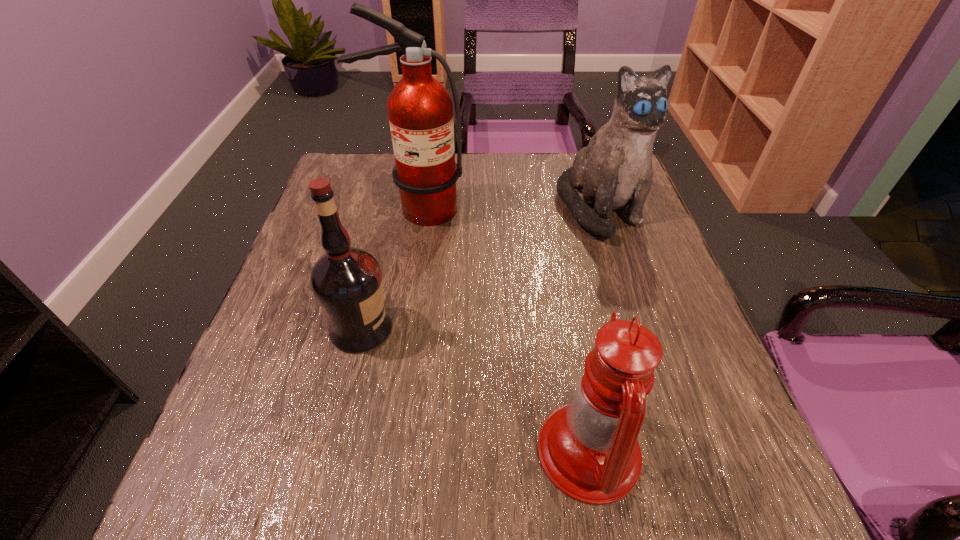
Where is `object at the near edge`? This screenshot has width=960, height=540. object at the near edge is located at coordinates (588, 449).

Identify the location of fire extinguisher present at the left edge. (420, 109).

You are a GUI agent. You are given a task and a screenshot of the screen. Output one action in this format:
    pyautogui.click(x=<x>, y=<y>)
    Task: Click on the liquor at the left edge
    This screenshot has width=960, height=540.
    Given the screenshot: What is the action you would take?
    pyautogui.click(x=347, y=283)

Where is `object that is at the right edge`? Image resolution: width=960 pixels, height=540 pixels. object that is at the right edge is located at coordinates (615, 170).

You are a GUI agent. You are given a task and a screenshot of the screen. Output one action in this format:
    pyautogui.click(x=<x>, y=<y>)
    Task: Click on the object located at the far left corner
    This screenshot has width=960, height=540.
    Given the screenshot: What is the action you would take?
    pos(420,109)

Locate an element on the screen. object present at the far right corner is located at coordinates (615, 170).

Find the location of a particular element. free space at the far edge is located at coordinates (564, 166).

Identify the location of free region at the near edge. (640, 499).

Find the location of a particular element. This screenshot has height=540, width=960. free space at the left edge is located at coordinates (263, 411).

Find the location of a particular element. The width and height of the screenshot is (960, 540). free region at the right edge of the desktop is located at coordinates (614, 247).